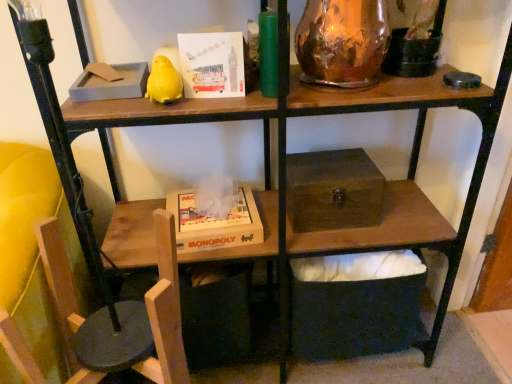
Question: Is copper metallic vase at upper right closer to the viewer compared to matte paper card at upper center?

Choices:
 (A) yes
 (B) no

Answer: (A)

Question: Is matte paper card at upper center at the back of copper metallic vase at upper right?

Choices:
 (A) yes
 (B) no

Answer: (B)

Question: Does copper metallic vase at upper right turn towards matte paper card at upper center?

Choices:
 (A) yes
 (B) no

Answer: (B)

Question: Is copper metallic vase at upper right outside matte paper card at upper center?

Choices:
 (A) yes
 (B) no

Answer: (A)

Question: Is copper metallic vase at upper right wider than matte paper card at upper center?

Choices:
 (A) yes
 (B) no

Answer: (A)

Question: Based on their positions, is brown wooden box at center, which ranks as the 1th box in top-to-bottom order, located to the left or right of copper metallic vase at upper right?

Choices:
 (A) left
 (B) right

Answer: (B)

Question: Is brown wooden box at center, arranged as the 2th box when ordered from the bottom, taller or shorter than copper metallic vase at upper right?

Choices:
 (A) tall
 (B) short

Answer: (B)

Question: From a real-world perspective, is brown wooden box at center, which ranks as the 1th box in top-to-bottom order, physically located above or below copper metallic vase at upper right?

Choices:
 (A) below
 (B) above

Answer: (A)

Question: Is brown wooden box at center, which ranks as the 1th box in top-to-bottom order, bigger or smaller than copper metallic vase at upper right?

Choices:
 (A) small
 (B) big

Answer: (B)

Question: From a real-world perspective, is wooden monopoly game at lower center physically located above or below wooden swivel chair at lower left?

Choices:
 (A) below
 (B) above

Answer: (A)

Question: In the image, is wooden monopoly game at lower center positioned in front of or behind wooden swivel chair at lower left?

Choices:
 (A) behind
 (B) front

Answer: (A)

Question: Considering the positions of wooden monopoly game at lower center and wooden swivel chair at lower left in the image, is wooden monopoly game at lower center taller or shorter than wooden swivel chair at lower left?

Choices:
 (A) tall
 (B) short

Answer: (B)

Question: Would you say wooden monopoly game at lower center is to the left or to the right of wooden swivel chair at lower left in the picture?

Choices:
 (A) right
 (B) left

Answer: (A)

Question: Looking at the image, does matte paper card at upper center seem bigger or smaller compared to wooden box at center, acting as the first box starting from the bottom?

Choices:
 (A) big
 (B) small

Answer: (B)

Question: Relative to wooden box at center, acting as the first box starting from the bottom, is matte paper card at upper center in front or behind?

Choices:
 (A) behind
 (B) front

Answer: (B)